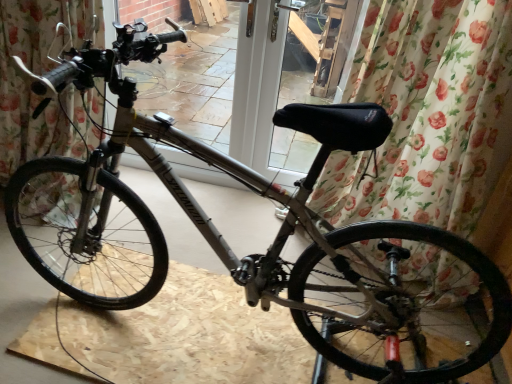
At what (x,y) coordinates should I click in order to perform the action: click on floral fabric curtain at center, which is the 2th curtain from right to left. Please return your answer as a coordinate pair (x, y). The image size is (512, 384). Looking at the image, I should click on (32, 92).

Describe the element at coordinates (194, 81) in the screenshot. I see `matte black handlebars at upper center` at that location.

What is the approximate width of floral fabric curtain at center, marked as the first curtain in a right-to-left arrangement?

floral fabric curtain at center, marked as the first curtain in a right-to-left arrangement, is 13.34 inches in width.

At what (x,y) coordinates should I click in order to perform the action: click on floral fabric curtain at center, marked as the first curtain in a right-to-left arrangement. Please return your answer as a coordinate pair (x, y). This screenshot has height=384, width=512. Looking at the image, I should click on (425, 112).

Locate an element on the screen. floral fabric curtain at center, the first curtain in the left-to-right sequence is located at coordinates (32, 92).

From a real-world perspective, is matte black handlebars at upper center positioned over matte gray bicycle at center based on gravity?

Yes.

Is matte black handlebars at upper center in contact with matte gray bicycle at center?

No, matte black handlebars at upper center is not making contact with matte gray bicycle at center.

Between matte black handlebars at upper center and matte gray bicycle at center, which one is positioned behind?

matte black handlebars at upper center is behind.

Which object is thinner, matte black handlebars at upper center or matte gray bicycle at center?

matte black handlebars at upper center.

Are floral fabric curtain at center, the first curtain in the left-to-right sequence, and floral fabric curtain at center, marked as the first curtain in a right-to-left arrangement, far apart?

Indeed, floral fabric curtain at center, the first curtain in the left-to-right sequence, is not near floral fabric curtain at center, marked as the first curtain in a right-to-left arrangement.

Is floral fabric curtain at center, the first curtain in the left-to-right sequence, behind floral fabric curtain at center, the 2th curtain from the left?

Yes, floral fabric curtain at center, the first curtain in the left-to-right sequence, is further from the viewer.

Based on the photo, from a real-world perspective, is floral fabric curtain at center, the first curtain in the left-to-right sequence, located beneath floral fabric curtain at center, marked as the first curtain in a right-to-left arrangement?

Correct, in the physical world, floral fabric curtain at center, the first curtain in the left-to-right sequence, is lower than floral fabric curtain at center, marked as the first curtain in a right-to-left arrangement.

Could you tell me if floral fabric curtain at center, the first curtain in the left-to-right sequence, is turned towards floral fabric curtain at center, the 2th curtain from the left?

No, floral fabric curtain at center, the first curtain in the left-to-right sequence, does not turn towards floral fabric curtain at center, the 2th curtain from the left.

Is the surface of matte gray bicycle at center in direct contact with floral fabric curtain at center, which is the 2th curtain from right to left?

No, matte gray bicycle at center is not with floral fabric curtain at center, which is the 2th curtain from right to left.

Is floral fabric curtain at center, which is the 2th curtain from right to left, a part of matte gray bicycle at center?

Definitely not — floral fabric curtain at center, which is the 2th curtain from right to left, is not inside matte gray bicycle at center.

From the image's perspective, would you say matte gray bicycle at center is shown under floral fabric curtain at center, the first curtain in the left-to-right sequence?

Yes.

From the picture: From a real-world perspective, is matte gray bicycle at center beneath floral fabric curtain at center, which is the 2th curtain from right to left?

Yes, from a real-world perspective, matte gray bicycle at center is beneath floral fabric curtain at center, which is the 2th curtain from right to left.

Is floral fabric curtain at center, marked as the first curtain in a right-to-left arrangement, wider or thinner than matte gray bicycle at center?

In the image, floral fabric curtain at center, marked as the first curtain in a right-to-left arrangement, appears to be more narrow than matte gray bicycle at center.

Does floral fabric curtain at center, the 2th curtain from the left, contain matte gray bicycle at center?

Definitely not — matte gray bicycle at center is not inside floral fabric curtain at center, the 2th curtain from the left.

Who is bigger, floral fabric curtain at center, marked as the first curtain in a right-to-left arrangement, or matte gray bicycle at center?

With larger size is floral fabric curtain at center, marked as the first curtain in a right-to-left arrangement.

Is floral fabric curtain at center, marked as the first curtain in a right-to-left arrangement, aimed at matte gray bicycle at center?

Yes, floral fabric curtain at center, marked as the first curtain in a right-to-left arrangement, is turned towards matte gray bicycle at center.

Consider the image. Is floral fabric curtain at center, marked as the first curtain in a right-to-left arrangement, outside of matte black handlebars at upper center?

Yes, floral fabric curtain at center, marked as the first curtain in a right-to-left arrangement, is not within matte black handlebars at upper center.

Considering the relative sizes of floral fabric curtain at center, the 2th curtain from the left, and matte black handlebars at upper center in the image provided, is floral fabric curtain at center, the 2th curtain from the left, wider than matte black handlebars at upper center?

Indeed, floral fabric curtain at center, the 2th curtain from the left, has a greater width compared to matte black handlebars at upper center.

From a real-world perspective, between floral fabric curtain at center, marked as the first curtain in a right-to-left arrangement, and matte black handlebars at upper center, who is vertically higher?

matte black handlebars at upper center is physically above.

Is floral fabric curtain at center, marked as the first curtain in a right-to-left arrangement, far away from matte black handlebars at upper center?

Yes, floral fabric curtain at center, marked as the first curtain in a right-to-left arrangement, and matte black handlebars at upper center are quite far apart.

From the image's perspective, is floral fabric curtain at center, the 2th curtain from the left, beneath floral fabric curtain at center, the first curtain in the left-to-right sequence?

Indeed, from the image's perspective, floral fabric curtain at center, the 2th curtain from the left, is shown beneath floral fabric curtain at center, the first curtain in the left-to-right sequence.

How many degrees apart are the facing directions of floral fabric curtain at center, the 2th curtain from the left, and floral fabric curtain at center, which is the 2th curtain from right to left?

1.2 degrees separate the facing orientations of floral fabric curtain at center, the 2th curtain from the left, and floral fabric curtain at center, which is the 2th curtain from right to left.

From a real-world perspective, is floral fabric curtain at center, marked as the first curtain in a right-to-left arrangement, above or below floral fabric curtain at center, the first curtain in the left-to-right sequence?

From a real-world perspective, floral fabric curtain at center, marked as the first curtain in a right-to-left arrangement, is physically above floral fabric curtain at center, the first curtain in the left-to-right sequence.

Considering the relative sizes of floral fabric curtain at center, the 2th curtain from the left, and floral fabric curtain at center, the first curtain in the left-to-right sequence, in the image provided, is floral fabric curtain at center, the 2th curtain from the left, smaller than floral fabric curtain at center, the first curtain in the left-to-right sequence,?

No, floral fabric curtain at center, the 2th curtain from the left, is not smaller than floral fabric curtain at center, the first curtain in the left-to-right sequence.

Considering the relative positions of floral fabric curtain at center, the first curtain in the left-to-right sequence, and matte black handlebars at upper center in the image provided, is floral fabric curtain at center, the first curtain in the left-to-right sequence, to the right of matte black handlebars at upper center from the viewer's perspective?

No.

Based on the photo, what's the angular difference between floral fabric curtain at center, the first curtain in the left-to-right sequence, and matte black handlebars at upper center's facing directions?

They differ by 0.344 degrees in their facing directions.

How much distance is there between floral fabric curtain at center, which is the 2th curtain from right to left, and matte black handlebars at upper center?

A distance of 4.79 feet exists between floral fabric curtain at center, which is the 2th curtain from right to left, and matte black handlebars at upper center.

From the image's perspective, is floral fabric curtain at center, which is the 2th curtain from right to left, above or below matte black handlebars at upper center?

floral fabric curtain at center, which is the 2th curtain from right to left, is situated lower than matte black handlebars at upper center in the image.

The image size is (512, 384). Find the location of `cardboard in front of the matte black handlebars at upper center`. cardboard in front of the matte black handlebars at upper center is located at coordinates [x=189, y=336].

This screenshot has height=384, width=512. I want to click on curtain on the left of floral fabric curtain at center, the 2th curtain from the left, so click(x=32, y=92).

When comparing their distances from matte gray bicycle at center, does floral fabric curtain at center, the 2th curtain from the left, or floral fabric curtain at center, the first curtain in the left-to-right sequence, seem further?

floral fabric curtain at center, the 2th curtain from the left, lies further to matte gray bicycle at center than the other object.

Based on the photo, which object lies further to the anchor point floral fabric curtain at center, the 2th curtain from the left, matte gray bicycle at center or floral fabric curtain at center, the first curtain in the left-to-right sequence?

Among the two, floral fabric curtain at center, the first curtain in the left-to-right sequence, is located further to floral fabric curtain at center, the 2th curtain from the left.

Looking at the image, which one is located further to matte gray bicycle at center, floral fabric curtain at center, which is the 2th curtain from right to left, or matte black handlebars at upper center?

Among the two, matte black handlebars at upper center is located further to matte gray bicycle at center.

Which object lies further to the anchor point matte black handlebars at upper center, floral fabric curtain at center, which is the 2th curtain from right to left, or floral fabric curtain at center, marked as the first curtain in a right-to-left arrangement?

Based on the image, floral fabric curtain at center, marked as the first curtain in a right-to-left arrangement, appears to be further to matte black handlebars at upper center.

Based on the photo, looking at the image, which one is located further to matte black handlebars at upper center, matte gray bicycle at center or floral fabric curtain at center, which is the 2th curtain from right to left?

Based on the image, matte gray bicycle at center appears to be further to matte black handlebars at upper center.

Looking at the image, which one is located closer to floral fabric curtain at center, the first curtain in the left-to-right sequence, floral fabric curtain at center, the 2th curtain from the left, or matte black handlebars at upper center?

floral fabric curtain at center, the 2th curtain from the left, lies closer to floral fabric curtain at center, the first curtain in the left-to-right sequence, than the other object.

Considering their positions, is floral fabric curtain at center, marked as the first curtain in a right-to-left arrangement, positioned further to matte black handlebars at upper center than matte gray bicycle at center?

matte gray bicycle at center is further to matte black handlebars at upper center.

Based on their spatial positions, is matte black handlebars at upper center or matte gray bicycle at center further from floral fabric curtain at center, the 2th curtain from the left?

Among the two, matte black handlebars at upper center is located further to floral fabric curtain at center, the 2th curtain from the left.

You are a GUI agent. You are given a task and a screenshot of the screen. Output one action in this format:
    pyautogui.click(x=<x>, y=<y>)
    Task: Click on the screen door located between floral fabric curtain at center, the first curtain in the left-to-right sequence, and floral fabric curtain at center, marked as the first curtain in a right-to-left arrangement, in the left-right direction
    This screenshot has height=384, width=512.
    Given the screenshot: What is the action you would take?
    pyautogui.click(x=194, y=81)

Locate an element on the screen. cardboard located between floral fabric curtain at center, which is the 2th curtain from right to left, and floral fabric curtain at center, marked as the first curtain in a right-to-left arrangement, in the left-right direction is located at coordinates (189, 336).